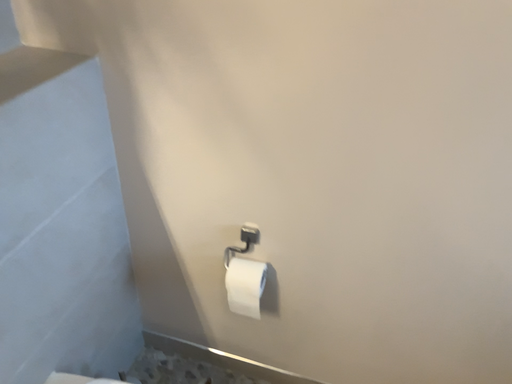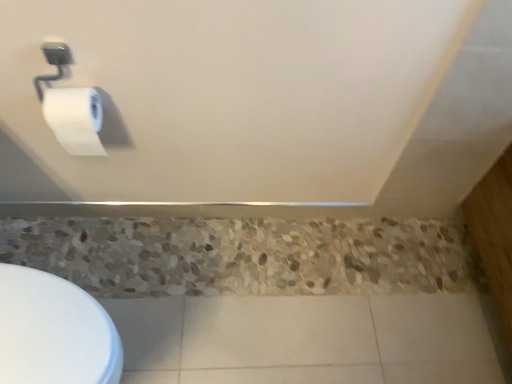
Question: How did the camera likely rotate when shooting the video?

Choices:
 (A) rotated left
 (B) rotated right

Answer: (B)